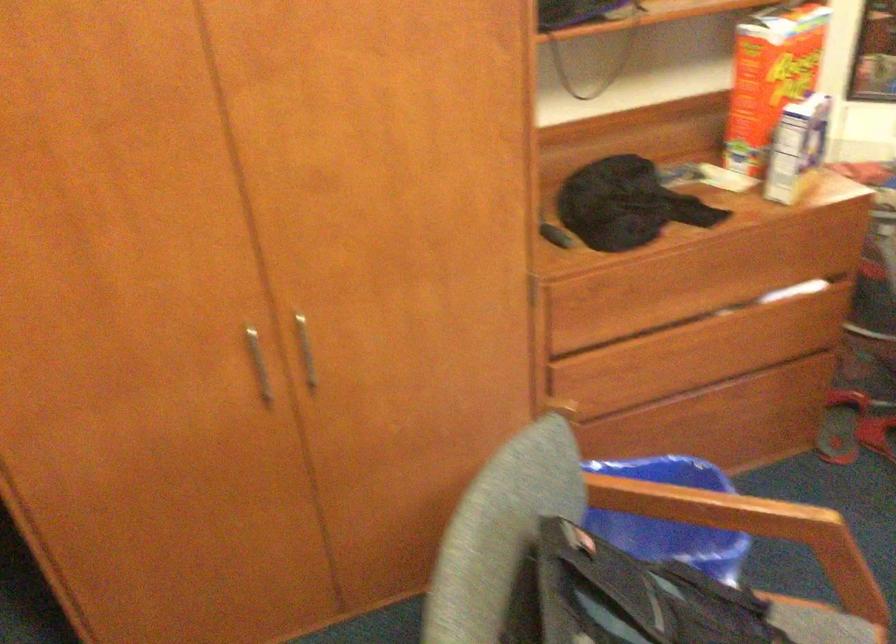
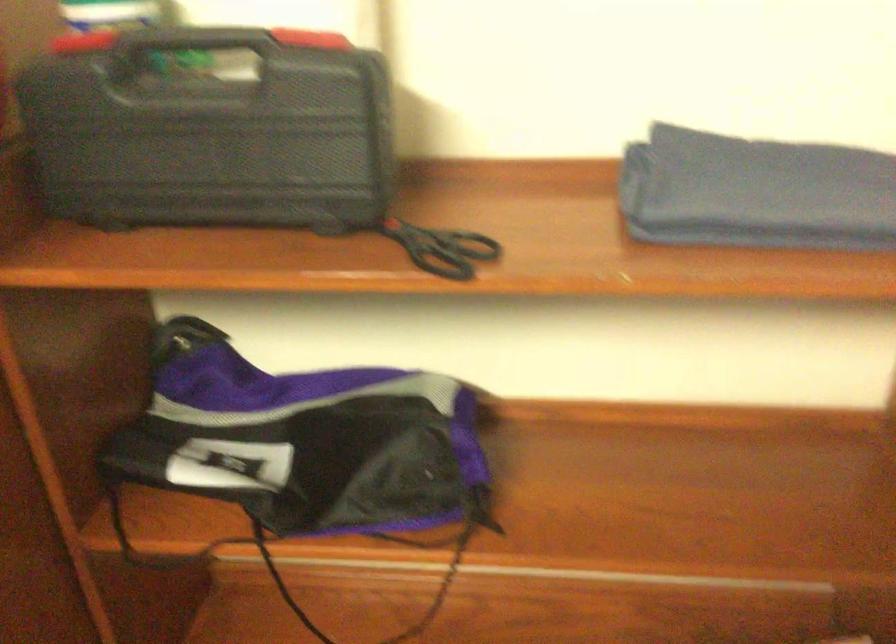
The images are taken continuously from a first-person perspective. In which direction are you moving?

The cameraman walked toward right, forward.